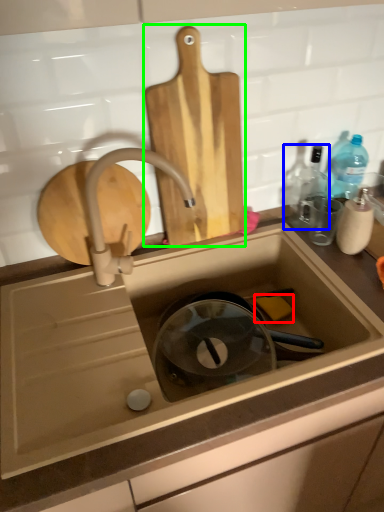
Question: Which object is positioned closest to soap (highlighted by a red box)? Select from bottle (highlighted by a blue box) and cutting board (highlighted by a green box).

Choices:
 (A) bottle
 (B) cutting board

Answer: (A)